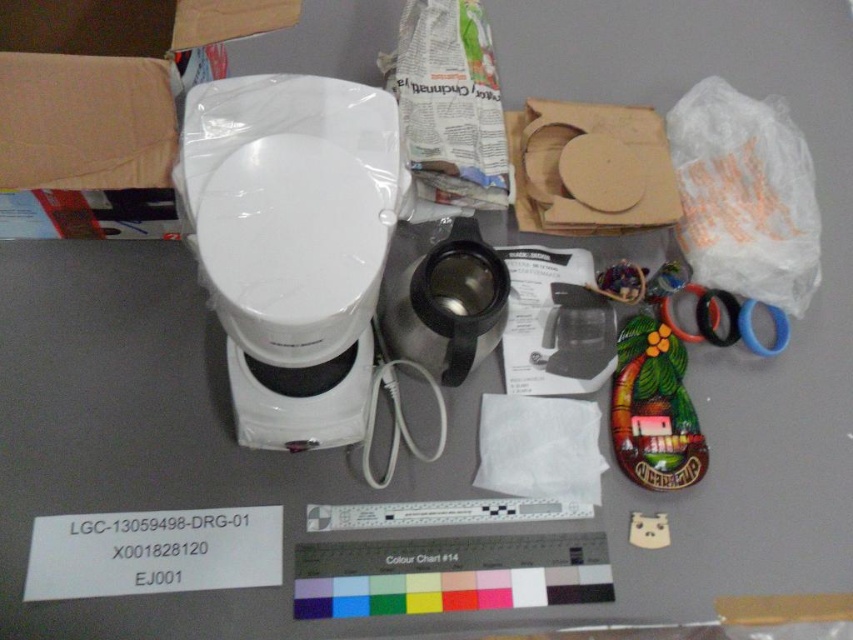
Can you confirm if white glossy toilet bowl at center is taller than matte green ceramic toy at lower right?

Yes, white glossy toilet bowl at center is taller than matte green ceramic toy at lower right.

Does white glossy toilet bowl at center lie in front of matte green ceramic toy at lower right?

Yes, white glossy toilet bowl at center is closer to the viewer.

Is point (360, 348) less distant than point (612, 403)?

Yes, point (360, 348) is closer to viewer.

Locate an element on the screen. This screenshot has width=853, height=640. white glossy toilet bowl at center is located at coordinates (291, 243).

Who is higher up, cardboard box at center or blue rubber band at right?

cardboard box at center is above.

Does cardboard box at center appear on the left side of blue rubber band at right?

Correct, you'll find cardboard box at center to the left of blue rubber band at right.

Does point (573, 141) lie in front of point (782, 323)?

Yes, point (573, 141) is closer to viewer.

At what (x,y) coordinates should I click in order to perform the action: click on cardboard box at center. Please return your answer as a coordinate pair (x, y). Looking at the image, I should click on (590, 168).

Can you confirm if white glossy toilet bowl at center is taller than blue rubber band at right?

Yes.

Between white glossy toilet bowl at center and blue rubber band at right, which one has more height?

With more height is white glossy toilet bowl at center.

Is point (235, 116) behind point (703, 324)?

No.

Find the location of a particular element. white glossy toilet bowl at center is located at coordinates coord(291,243).